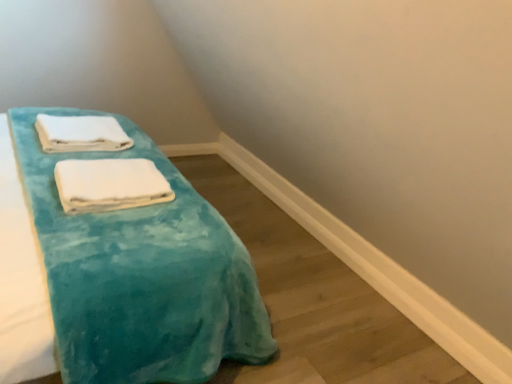
Question: Considering the relative positions of white soft towel at upper left, marked as the first towel in a top-to-bottom arrangement, and turquoise soft towel at center in the image provided, is white soft towel at upper left, marked as the first towel in a top-to-bottom arrangement, to the right of turquoise soft towel at center from the viewer's perspective?

Choices:
 (A) yes
 (B) no

Answer: (B)

Question: Does white soft towel at upper left, which is the 2th towel from front to back, appear on the left side of turquoise soft towel at center?

Choices:
 (A) no
 (B) yes

Answer: (B)

Question: Does white soft towel at upper left, which is the 1th towel from back to front, lie behind turquoise soft towel at center?

Choices:
 (A) no
 (B) yes

Answer: (B)

Question: Is white soft towel at upper left, marked as the first towel in a top-to-bottom arrangement, outside turquoise soft towel at center?

Choices:
 (A) yes
 (B) no

Answer: (B)

Question: Could you tell me if white soft towel at upper left, placed as the second towel when sorted from bottom to top, is facing turquoise soft towel at center?

Choices:
 (A) yes
 (B) no

Answer: (A)

Question: Based on their positions, is turquoise soft towel at center located to the left or right of white soft towel at center, which appears as the second towel when viewed from the back?

Choices:
 (A) right
 (B) left

Answer: (B)

Question: Is turquoise soft towel at center taller or shorter than white soft towel at center, arranged as the first towel when ordered from the bottom?

Choices:
 (A) tall
 (B) short

Answer: (A)

Question: In terms of size, does turquoise soft towel at center appear bigger or smaller than white soft towel at center, which appears as the second towel when viewed from the back?

Choices:
 (A) big
 (B) small

Answer: (A)

Question: From a real-world perspective, is turquoise soft towel at center positioned above or below white soft towel at center, marked as the 1th towel in a front-to-back arrangement?

Choices:
 (A) above
 (B) below

Answer: (A)

Question: From the image's perspective, relative to white soft towel at center, arranged as the first towel when ordered from the bottom, is white soft towel at upper left, which is the 2th towel from front to back, above or below?

Choices:
 (A) above
 (B) below

Answer: (A)

Question: Considering the positions of white soft towel at upper left, which is the 2th towel from front to back, and white soft towel at center, marked as the 1th towel in a front-to-back arrangement, in the image, is white soft towel at upper left, which is the 2th towel from front to back, bigger or smaller than white soft towel at center, marked as the 1th towel in a front-to-back arrangement,?

Choices:
 (A) big
 (B) small

Answer: (A)

Question: From a real-world perspective, is white soft towel at upper left, marked as the first towel in a top-to-bottom arrangement, physically located above or below white soft towel at center, which is the second towel in top-to-bottom order?

Choices:
 (A) above
 (B) below

Answer: (A)

Question: In terms of width, does white soft towel at upper left, marked as the first towel in a top-to-bottom arrangement, look wider or thinner when compared to white soft towel at center, marked as the 1th towel in a front-to-back arrangement?

Choices:
 (A) thin
 (B) wide

Answer: (B)

Question: From the image's perspective, relative to white soft towel at upper left, which is the 1th towel from back to front, is turquoise soft towel at center above or below?

Choices:
 (A) above
 (B) below

Answer: (B)

Question: Would you say turquoise soft towel at center is inside or outside white soft towel at upper left, marked as the first towel in a top-to-bottom arrangement?

Choices:
 (A) inside
 (B) outside

Answer: (B)